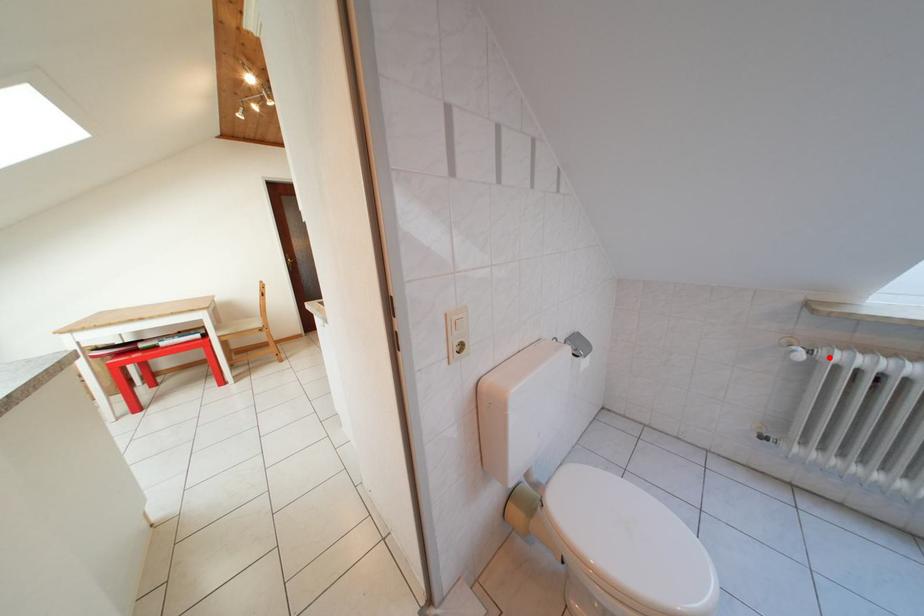
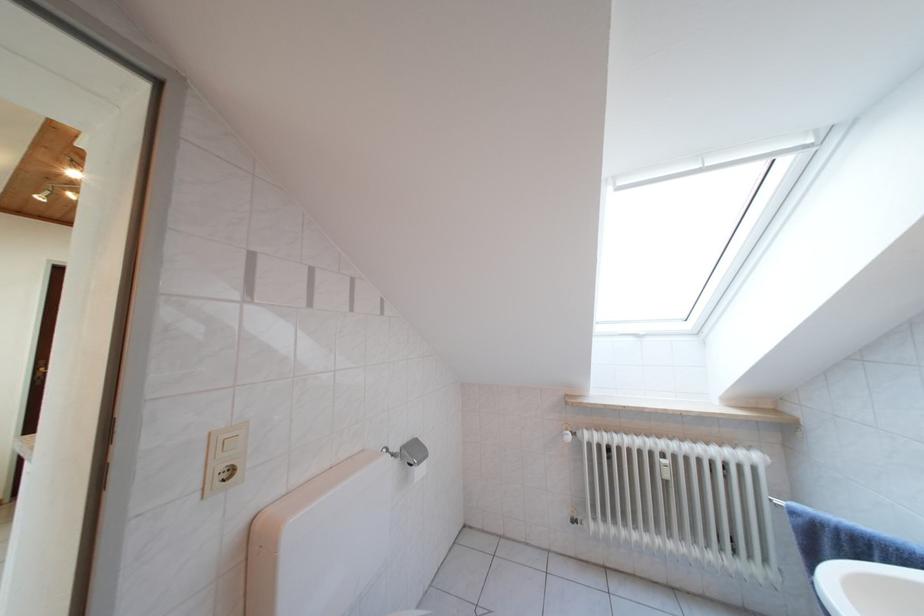
Question: I am providing you with two images of the same scene from different viewpoints. In image1, a red point is highlighted. Considering the same 3D point in image2, which of the following is correct?

Choices:
 (A) It is closer
 (B) It is farther

Answer: (B)